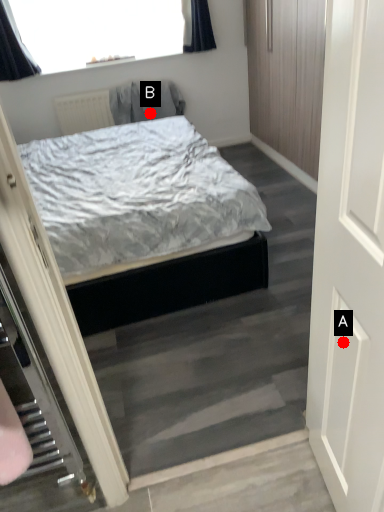
Question: Two points are circled on the image, labeled by A and B beside each circle. Which point is closer to the camera?

Choices:
 (A) A is closer
 (B) B is closer

Answer: (A)